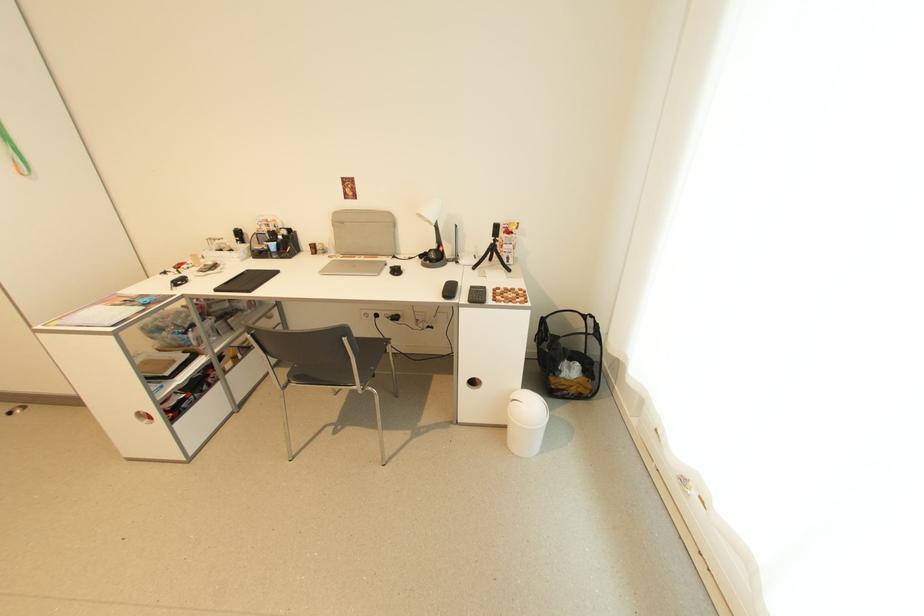
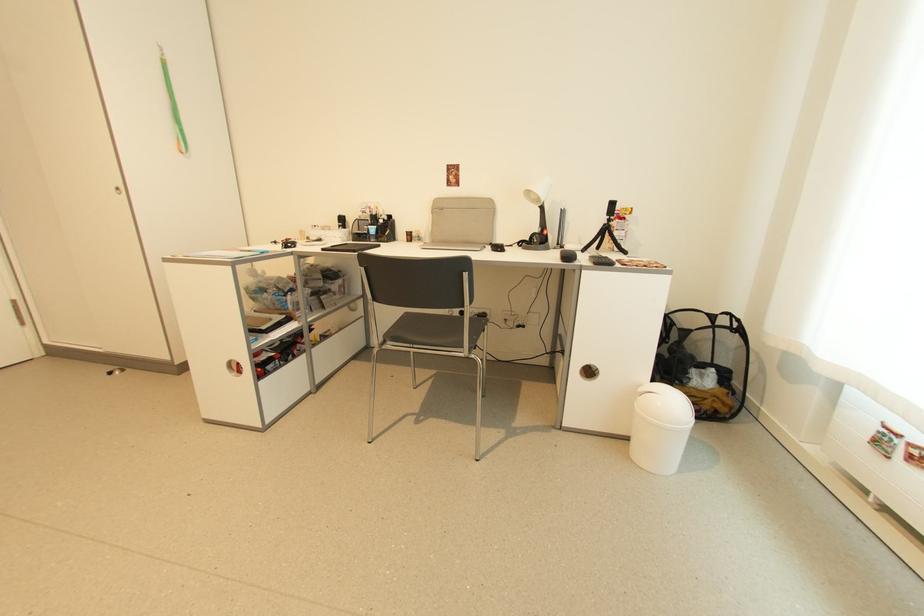
Locate, in the second image, the point that corresponds to point 473,302 in the first image.

(600, 265)